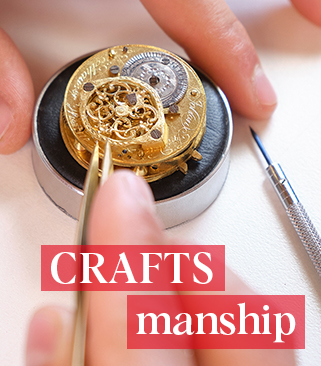
I want to click on leather cushion, so click(x=59, y=86), click(x=59, y=153), click(x=176, y=184), click(x=218, y=127).